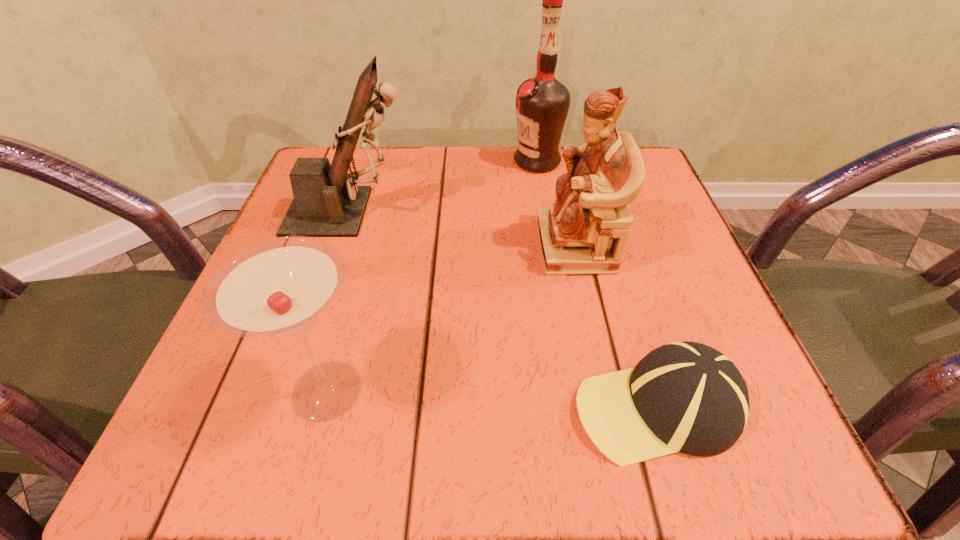
At what (x,y) coordinates should I click in order to perform the action: click on liquor. Please return your answer as a coordinate pair (x, y). The height and width of the screenshot is (540, 960). Looking at the image, I should click on (542, 103).

The image size is (960, 540). What are the coordinates of `the left figurine` in the screenshot? It's located at [x=327, y=202].

Locate an element on the screen. The width and height of the screenshot is (960, 540). the right figurine is located at coordinates (585, 231).

The width and height of the screenshot is (960, 540). Identify the location of martini. (279, 288).

Where is `baseball cap`? baseball cap is located at coordinates (687, 397).

You are a GUI agent. You are given a task and a screenshot of the screen. Output one action in this format:
    pyautogui.click(x=<x>, y=<y>)
    Task: Click on the free space located 0.080m on the front and back of the farthest object
    Image resolution: width=960 pixels, height=540 pixels.
    Given the screenshot: What is the action you would take?
    pyautogui.click(x=476, y=161)

Where is `free space located on the front and back of the farthest object`? The image size is (960, 540). free space located on the front and back of the farthest object is located at coordinates (454, 161).

At what (x,y) coordinates should I click in order to perform the action: click on vacant region located 0.340m on the front and back of the farthest object. Please return your answer as a coordinate pair (x, y). This screenshot has height=540, width=960. Looking at the image, I should click on (359, 161).

At what (x,y) coordinates should I click in order to perform the action: click on vacant space located on the front-facing side of the left figurine. Please return your answer as a coordinate pair (x, y). The height and width of the screenshot is (540, 960). Looking at the image, I should click on (541, 212).

At what (x,y) coordinates should I click in order to perform the action: click on vacant space located on the front-facing side of the right figurine. Please return your answer as a coordinate pair (x, y). This screenshot has height=540, width=960. Looking at the image, I should click on (471, 246).